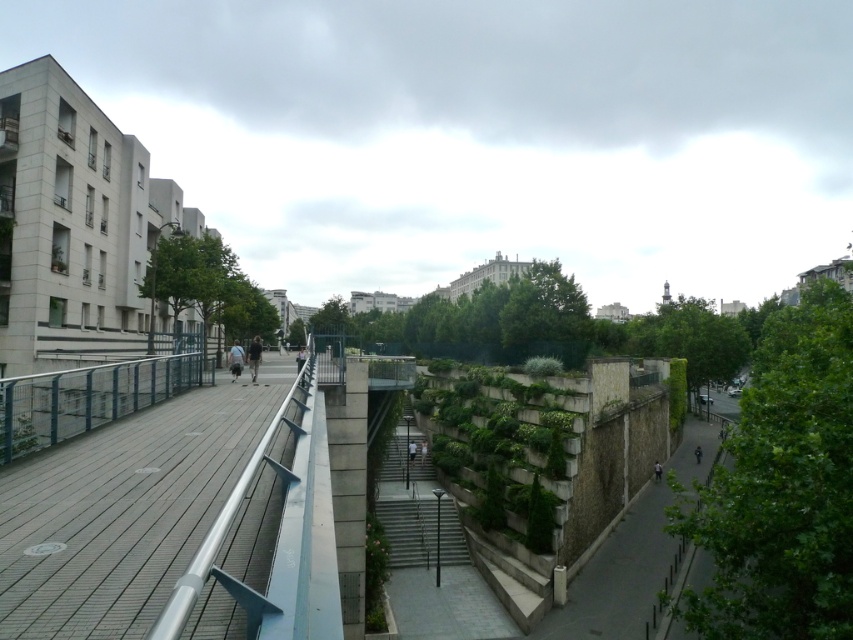
Question: From the image, what is the correct spatial relationship of silver metallic railing at left in relation to metallic blue railing at left?

Choices:
 (A) above
 (B) below

Answer: (B)

Question: Among these objects, which one is nearest to the camera?

Choices:
 (A) silver metallic railing at left
 (B) metallic blue railing at left

Answer: (A)

Question: Among these points, which one is farthest from the camera?

Choices:
 (A) (96, 424)
 (B) (239, 372)
 (C) (135, 413)

Answer: (B)

Question: Is silver metallic railing at left wider than light gray fabric jacket at center?

Choices:
 (A) yes
 (B) no

Answer: (B)

Question: Does silver metallic railing at left have a larger size compared to metallic blue railing at left?

Choices:
 (A) no
 (B) yes

Answer: (B)

Question: Which object is the closest to the metallic blue railing at left?

Choices:
 (A) silver metallic railing at left
 (B) light gray fabric jacket at center

Answer: (A)